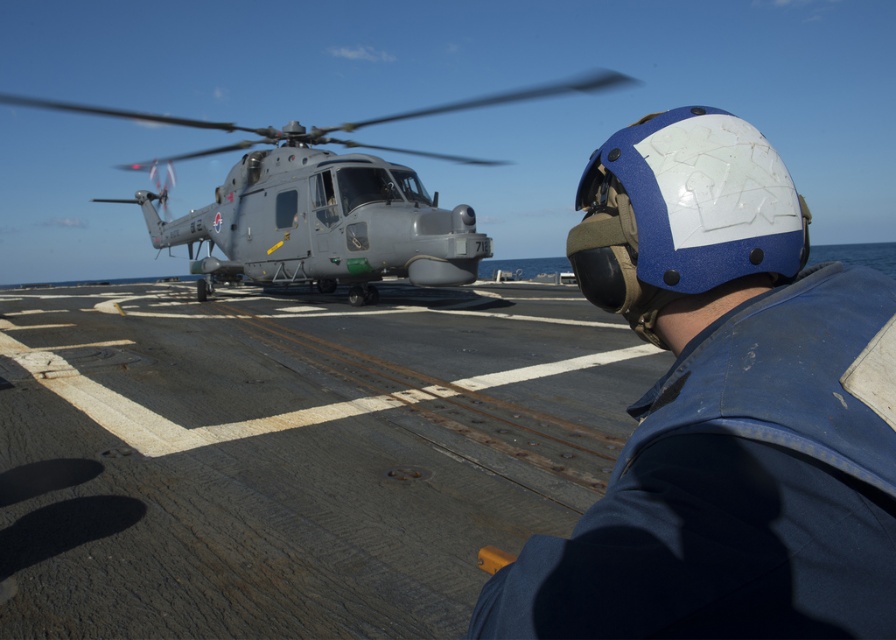
You are standing on the deck of the naval ship and want to reach a specific point marked at coordinates point (751, 547). If your reach extends 16 inches forward, will you be able to touch that point without moving closer?

The distance of point (751, 547) from viewer is 15.99 inches, so yes, you can touch it since your reach extends 16 inches forward which is slightly longer than the distance.

Consider the image. You are a deckhand on the aircraft carrier and need to move the gray matte helicopter at center to make space. Which object, the blue matte helmet at upper right or another item, must you first move out of the way?

The blue matte helmet at upper right is positioned under the gray matte helicopter at center, so you must move the blue matte helmet at upper right first before moving the helicopter.